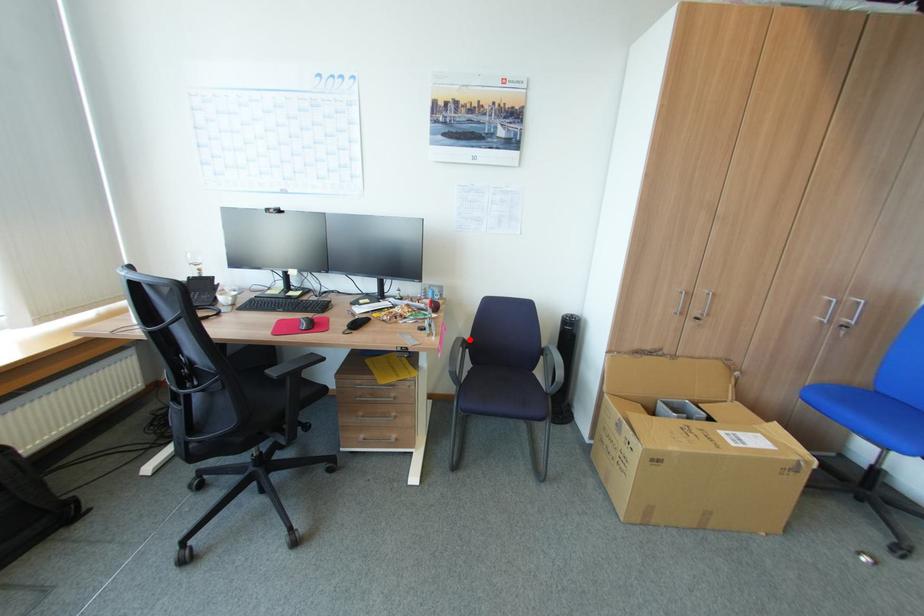
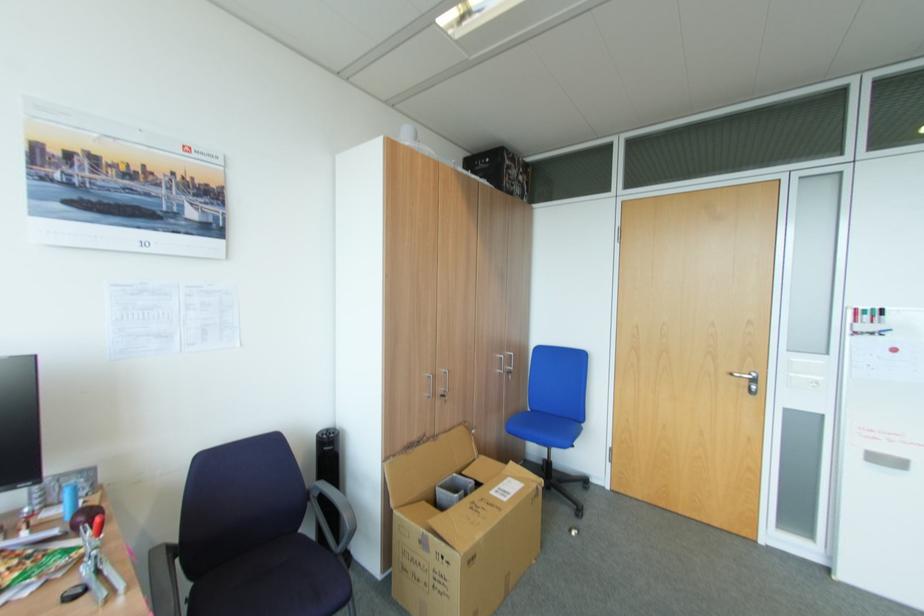
The point at the highlighted location is marked in the first image. Where is the corresponding point in the second image?

(174, 546)